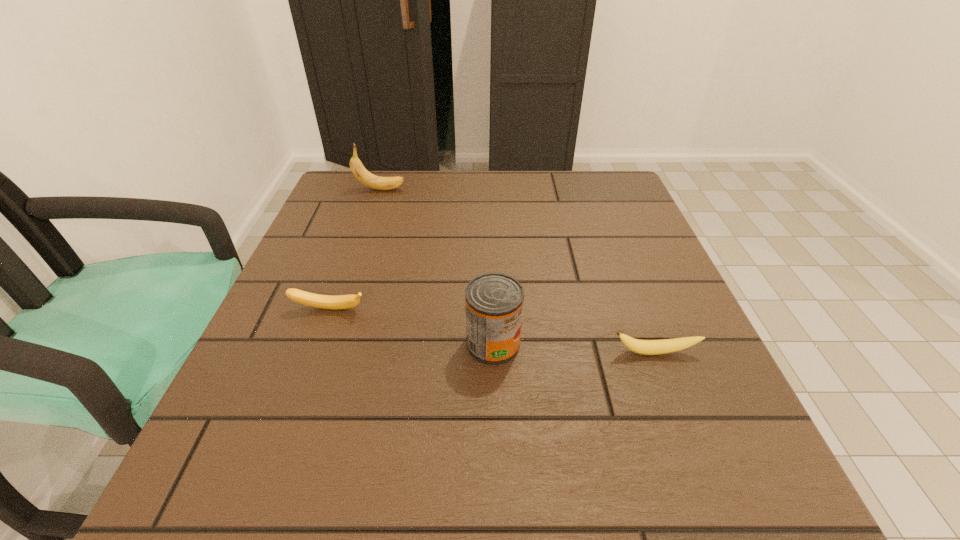
Identify which object is the second closest to the can. Please provide its 2D coordinates. Your answer should be formatted as a tuple, i.e. [(x, y)], where the tuple contains the x and y coordinates of a point satisfying the conditions above.

[(306, 298)]

Locate which object is the second closest to the can. Please provide its 2D coordinates. Your answer should be formatted as a tuple, i.e. [(x, y)], where the tuple contains the x and y coordinates of a point satisfying the conditions above.

[(306, 298)]

The image size is (960, 540). I want to click on the closest banana to the third nearest object, so click(360, 172).

Find the location of a particular element. banana object that ranks as the closest to the rightmost object is located at coordinates (306, 298).

This screenshot has width=960, height=540. I want to click on vacant position in the image that satisfies the following two spatial constraints: 1. at the start of the peel on the farthest object; 2. at the stem of the third nearest object, so click(341, 309).

Where is `vacant area in the image that satisfies the following two spatial constraints: 1. at the start of the peel on the farthest object; 2. at the stem of the third nearest object`? This screenshot has height=540, width=960. vacant area in the image that satisfies the following two spatial constraints: 1. at the start of the peel on the farthest object; 2. at the stem of the third nearest object is located at coordinates (341, 309).

Locate an element on the screen. This screenshot has width=960, height=540. vacant space that satisfies the following two spatial constraints: 1. at the stem of the can; 2. on the right side of the third nearest object is located at coordinates (317, 343).